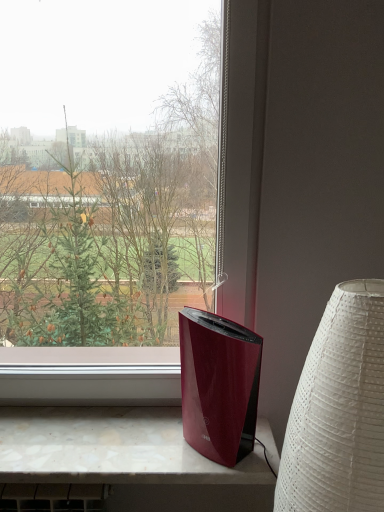
Describe the element at coordinates (120, 462) in the screenshot. I see `marble-like surface at lower center` at that location.

Measure the distance between point (7, 446) and camera.

Point (7, 446) and camera are 38.98 inches apart from each other.

At what (x,y) coordinates should I click in order to perform the action: click on marble-like surface at lower center. Please return your answer as a coordinate pair (x, y). The height and width of the screenshot is (512, 384). Looking at the image, I should click on (120, 462).

The width and height of the screenshot is (384, 512). What do you see at coordinates (339, 410) in the screenshot? I see `white textured lampshade at right` at bounding box center [339, 410].

The height and width of the screenshot is (512, 384). Find the location of `white textured lampshade at right`. white textured lampshade at right is located at coordinates (339, 410).

The width and height of the screenshot is (384, 512). What are the coordinates of `marble-like surface at lower center` in the screenshot? It's located at (120, 462).

Between marble-like surface at lower center and white textured lampshade at right, which one appears on the right side from the viewer's perspective?

white textured lampshade at right is more to the right.

Considering the positions of objects marble-like surface at lower center and white textured lampshade at right in the image provided, who is in front, marble-like surface at lower center or white textured lampshade at right?

white textured lampshade at right.

Which is behind, point (36, 495) or point (294, 443)?

The point (36, 495) is farther.

From the image's perspective, is marble-like surface at lower center on top of white textured lampshade at right?

No, from the image's perspective, marble-like surface at lower center is not on top of white textured lampshade at right.

From a real-world perspective, is marble-like surface at lower center under white textured lampshade at right?

Yes, from a real-world perspective, marble-like surface at lower center is beneath white textured lampshade at right.

Which of these two, marble-like surface at lower center or white textured lampshade at right, is wider?

white textured lampshade at right.

Who is shorter, marble-like surface at lower center or white textured lampshade at right?

marble-like surface at lower center is shorter.

Does marble-like surface at lower center have a smaller size compared to white textured lampshade at right?

Yes.

Would you say marble-like surface at lower center is outside white textured lampshade at right?

marble-like surface at lower center is positioned outside white textured lampshade at right.

Is marble-like surface at lower center with white textured lampshade at right?

No, marble-like surface at lower center is not beside white textured lampshade at right.

Is marble-like surface at lower center looking in the opposite direction of white textured lampshade at right?

marble-like surface at lower center is not turned away from white textured lampshade at right.

What are the coordinates of `computer desk below the white textured lampshade at right (from a real-world perspective)` in the screenshot? It's located at (120, 462).

Would you say white textured lampshade at right is to the left or to the right of marble-like surface at lower center in the picture?

Clearly, white textured lampshade at right is on the right of marble-like surface at lower center in the image.

Consider the image. Which object is closer to the camera taking this photo, white textured lampshade at right or marble-like surface at lower center?

white textured lampshade at right is in front.

Which is closer to the camera, [361,279] or [100,433]?

Point [361,279]

From the image's perspective, is white textured lampshade at right located above marble-like surface at lower center?

Yes.

From a real-world perspective, is white textured lampshade at right above or below marble-like surface at lower center?

white textured lampshade at right is situated higher than marble-like surface at lower center in the real world.

Is white textured lampshade at right wider than marble-like surface at lower center?

Yes.

Does white textured lampshade at right have a lesser height compared to marble-like surface at lower center?

No, white textured lampshade at right is not shorter than marble-like surface at lower center.

Between white textured lampshade at right and marble-like surface at lower center, which one has larger size?

Bigger between the two is white textured lampshade at right.

Is white textured lampshade at right inside the boundaries of marble-like surface at lower center, or outside?

white textured lampshade at right cannot be found inside marble-like surface at lower center.

Is white textured lampshade at right placed right next to marble-like surface at lower center?

They are not placed beside each other.

Could you tell me if white textured lampshade at right is facing marble-like surface at lower center?

No.

Locate an element on the screen. This screenshot has height=512, width=384. computer desk that is on the left side of white textured lampshade at right is located at coordinates (120, 462).

You are a GUI agent. You are given a task and a screenshot of the screen. Output one action in this format:
    pyautogui.click(x=<x>, y=<y>)
    Task: Click on the lamp in front of the marble-like surface at lower center
    
    Given the screenshot: What is the action you would take?
    pyautogui.click(x=339, y=410)

At what (x,y) coordinates should I click in order to perform the action: click on computer desk on the left of white textured lampshade at right. Please return your answer as a coordinate pair (x, y). Image resolution: width=384 pixels, height=512 pixels. Looking at the image, I should click on (x=120, y=462).